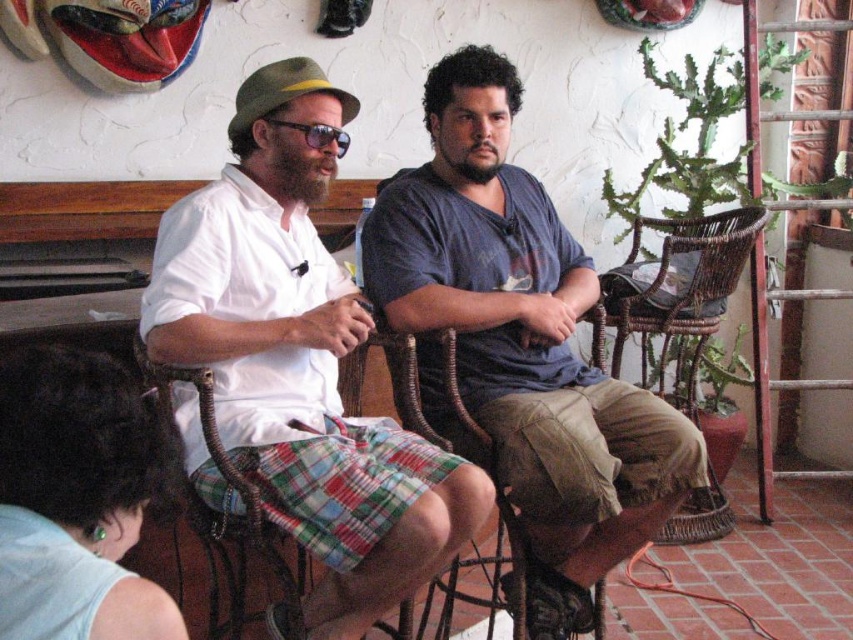
Question: Estimate the real-world distances between objects in this image. Which object is closer to the white cotton shirt at center?

Choices:
 (A) matte plastic sunglasses at center
 (B) green plaid shorts at lower left
 (C) woven rattan chair at right
 (D) blue cotton shirt at center

Answer: (D)

Question: Can you confirm if plaid cotton kilt at center is positioned to the right of woven wood chair at center?

Choices:
 (A) no
 (B) yes

Answer: (A)

Question: Which point is closer to the camera taking this photo?

Choices:
 (A) (727, 524)
 (B) (622, 480)
 (C) (340, 392)

Answer: (B)

Question: Which of these objects is positioned farthest from the white cotton shirt at center?

Choices:
 (A) matte plastic sunglasses at center
 (B) plaid cotton kilt at center
 (C) blue cotton shirt at center
 (D) woven wood chair at center

Answer: (A)

Question: Is white cotton shirt at center positioned at the back of woven rattan chair at right?

Choices:
 (A) no
 (B) yes

Answer: (A)

Question: Is blue cotton shirt at center to the left of green plaid shorts at lower left from the viewer's perspective?

Choices:
 (A) yes
 (B) no

Answer: (B)